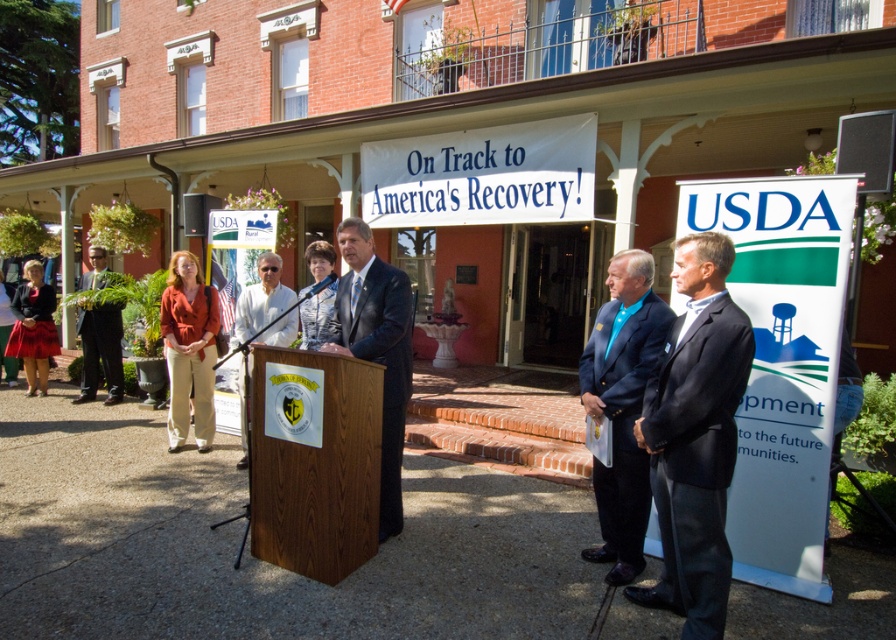
You are at an outdoor event in front of a historic red brick building. You see a man in a dark suit standing behind a wooden podium with a sign that says Rural Development. There is also a point at coordinates (188,349). What is located at that point?

The matte orange blazer at center is located at point (188,349).

You are attending an outdoor event and want to take a photo of the speaker in the matte orange blazer at center and the person in the matte black jacket at lower left. Which one should you focus on first to ensure they are both in clear focus?

You should focus on the matte orange blazer at center first since it is closer to the viewer than the matte black jacket at lower left, ensuring both are in focus by starting with the closer subject.